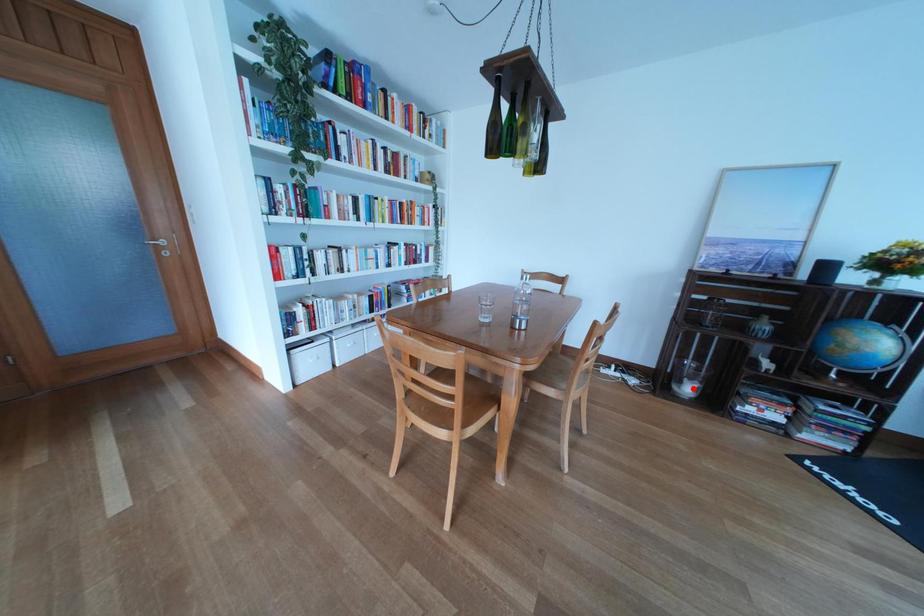
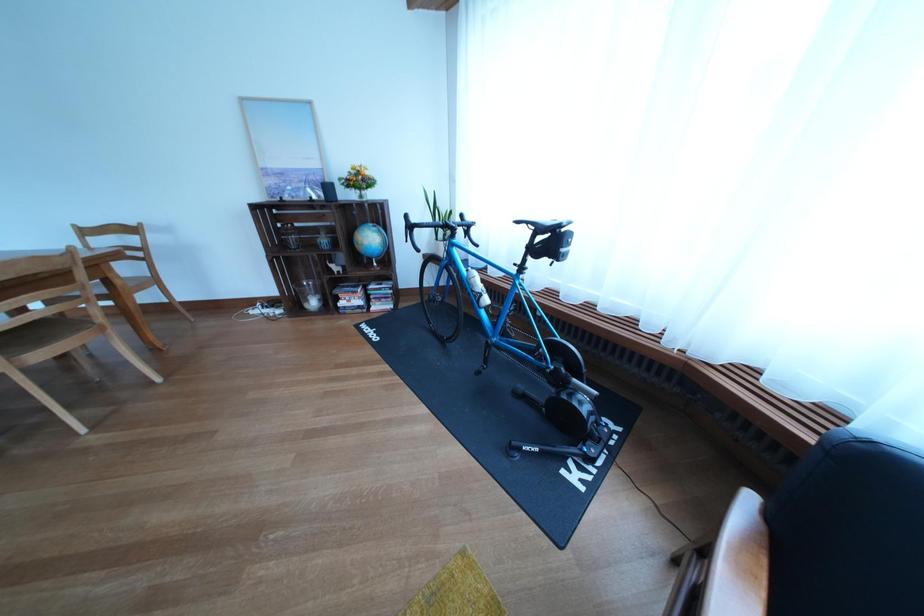
Question: I am providing you with two images of the same scene from different viewpoints. A red point is shown in image1. For the corresponding object point in image2, is it positioned nearer or farther from the camera?

Choices:
 (A) Nearer
 (B) Farther

Answer: (B)